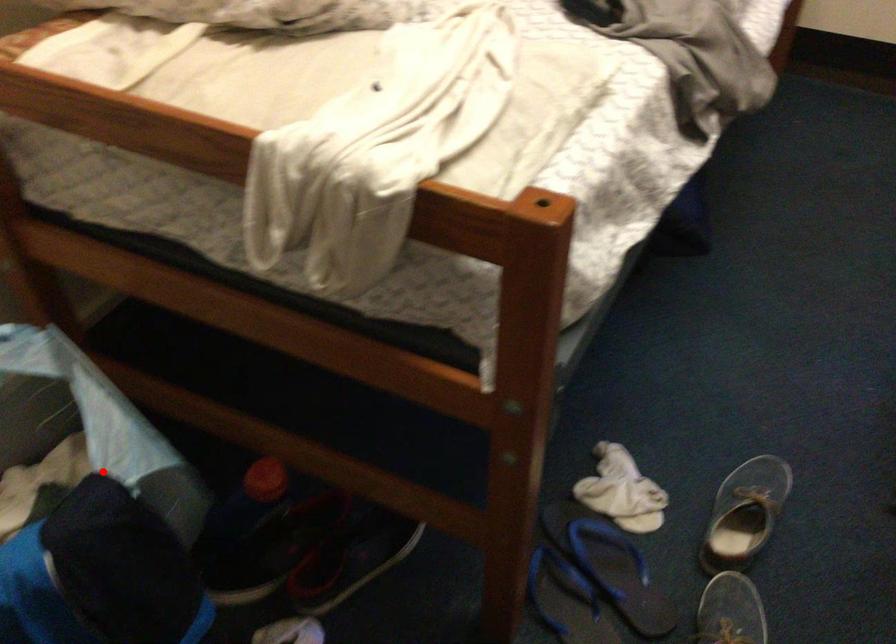
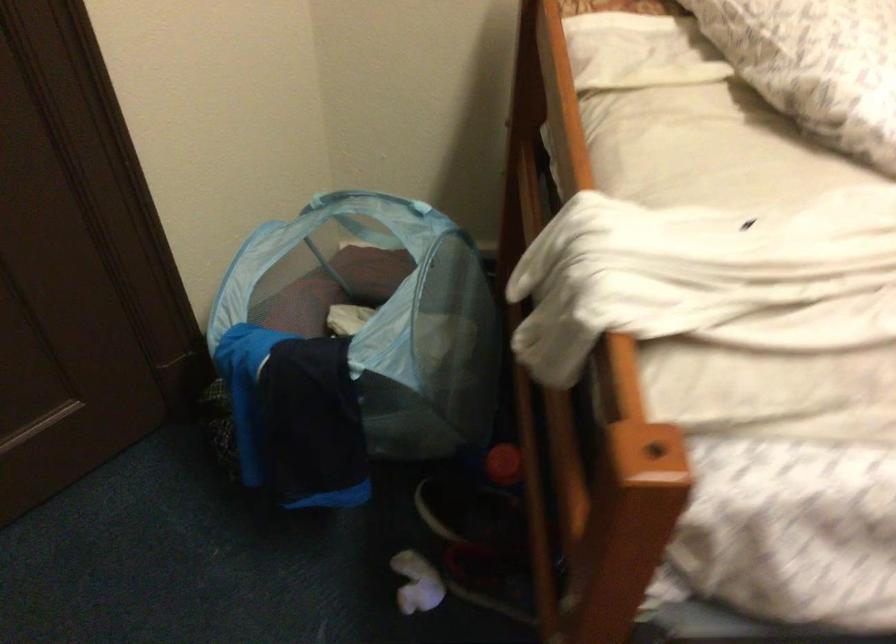
Where in the second image is the point corresponding to the highlighted location from the first image?

(354, 345)